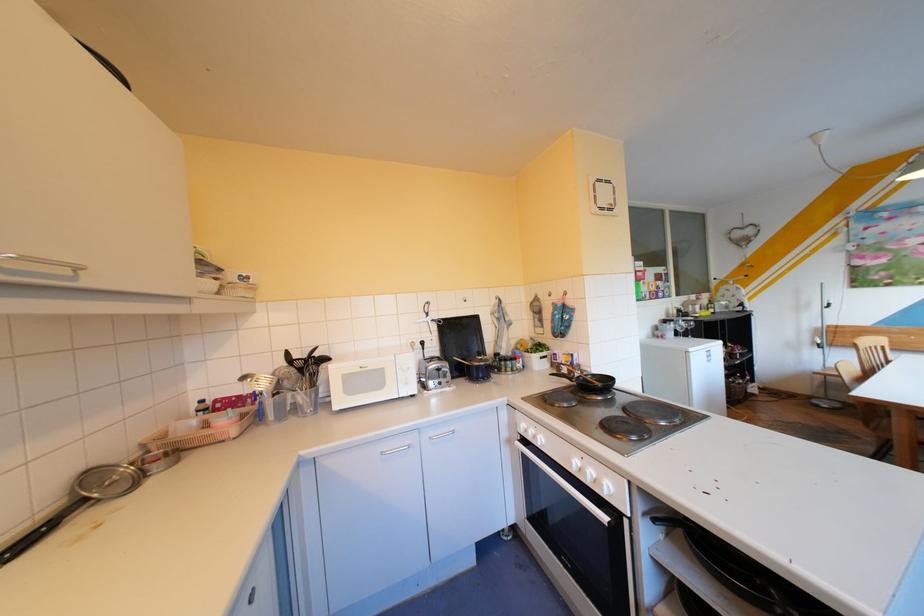
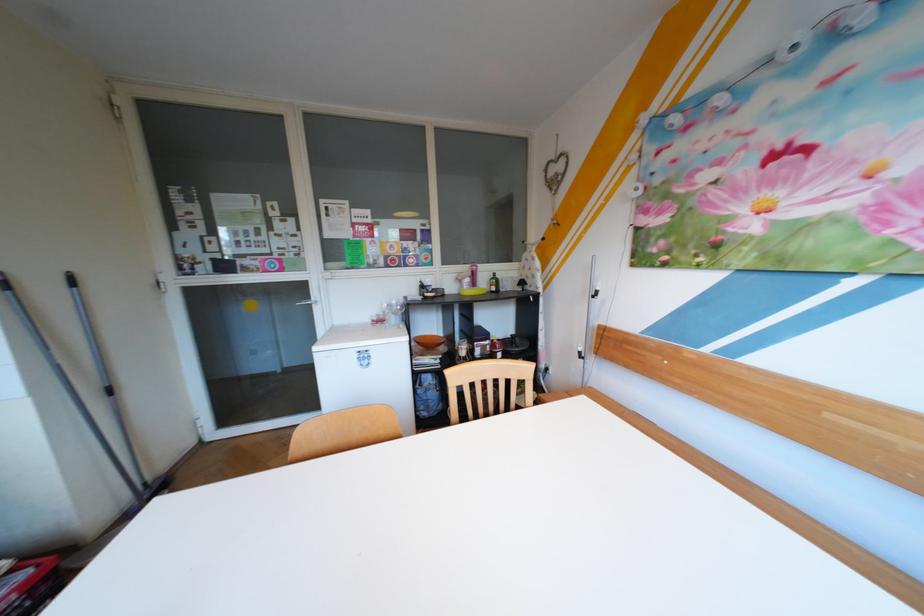
Question: Which direction would the cameraman need to move to produce the second image? Reply with the corresponding letter.

Choices:
 (A) Left
 (B) Right
 (C) Forward
 (D) Backward

Answer: (B)